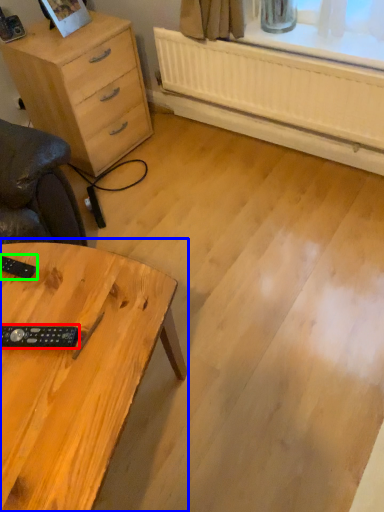
Question: Which object is positioned farthest from control (highlighted by a red box)? Select from table (highlighted by a blue box) and control (highlighted by a green box).

Choices:
 (A) table
 (B) control

Answer: (B)